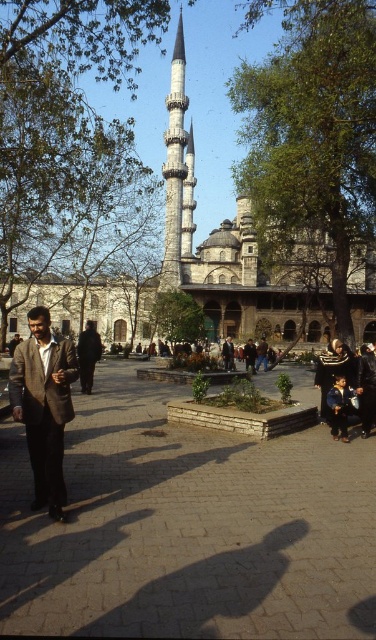
Question: Considering the relative positions of matte brown suit at left and white stone minaret at center in the image provided, where is matte brown suit at left located with respect to white stone minaret at center?

Choices:
 (A) left
 (B) right

Answer: (A)

Question: Which object appears closest to the camera in this image?

Choices:
 (A) brick pavement at center
 (B) dark gray suit at center
 (C) dark blue jeans at lower right

Answer: (A)

Question: Is brick pavement at center further to the viewer compared to dark gray suit at center?

Choices:
 (A) yes
 (B) no

Answer: (B)

Question: Is white stone minaret at center thinner than dark gray suit at center?

Choices:
 (A) yes
 (B) no

Answer: (B)

Question: Among these objects, which one is nearest to the camera?

Choices:
 (A) white stone minaret at center
 (B) dark blue jeans at lower right
 (C) brick pavement at center

Answer: (C)

Question: Which point appears farthest from the camera in this image?

Choices:
 (A) (18, 385)
 (B) (184, 220)
 (C) (100, 349)
 (D) (336, 438)

Answer: (B)